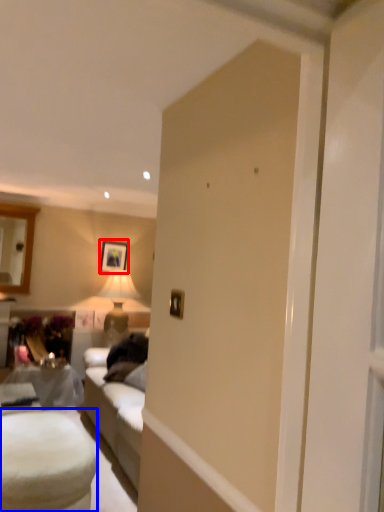
Question: Which object appears farthest to the camera in this image, picture frame (highlighted by a red box) or table (highlighted by a blue box)?

Choices:
 (A) picture frame
 (B) table

Answer: (A)